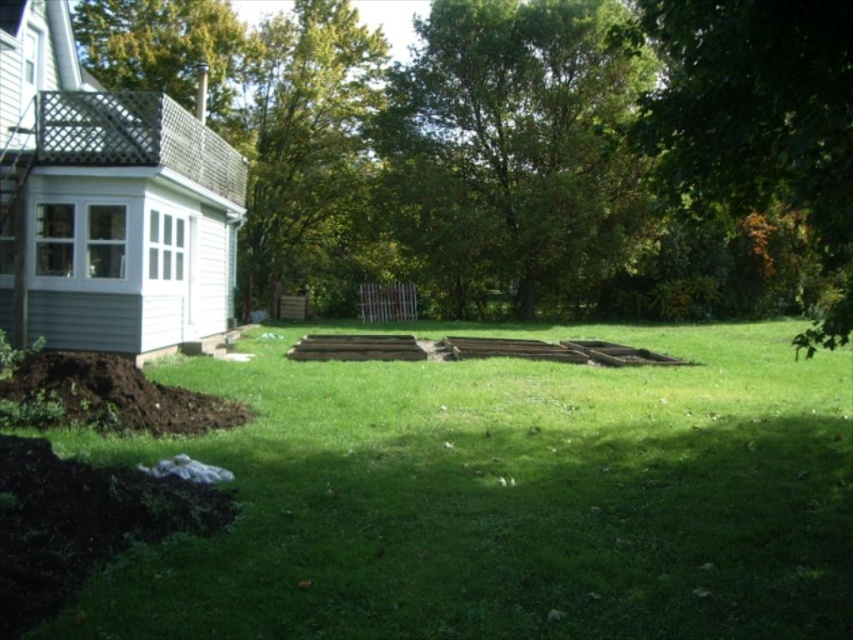
Who is more forward, (x=223, y=438) or (x=556, y=147)?

Point (x=223, y=438)

At what (x,y) coordinates should I click in order to perform the action: click on green grass at center. Please return your answer as a coordinate pair (x, y). Looking at the image, I should click on (505, 499).

Who is higher up, green leafy tree at center or green leafy tree at upper left?

green leafy tree at upper left

Does point (502, 26) come behind point (256, 131)?

No.

Is point (482, 76) less distant than point (381, 67)?

Yes, point (482, 76) is closer to viewer.

At what (x,y) coordinates should I click in order to perform the action: click on green leafy tree at center. Please return your answer as a coordinate pair (x, y). The image size is (853, 640). Looking at the image, I should click on (512, 147).

Is green grass at center taller than green leafy tree at upper left?

In fact, green grass at center may be shorter than green leafy tree at upper left.

Consider the image. Can you confirm if green grass at center is wider than green leafy tree at upper left?

In fact, green grass at center might be narrower than green leafy tree at upper left.

What are the coordinates of `green grass at center` in the screenshot? It's located at (505, 499).